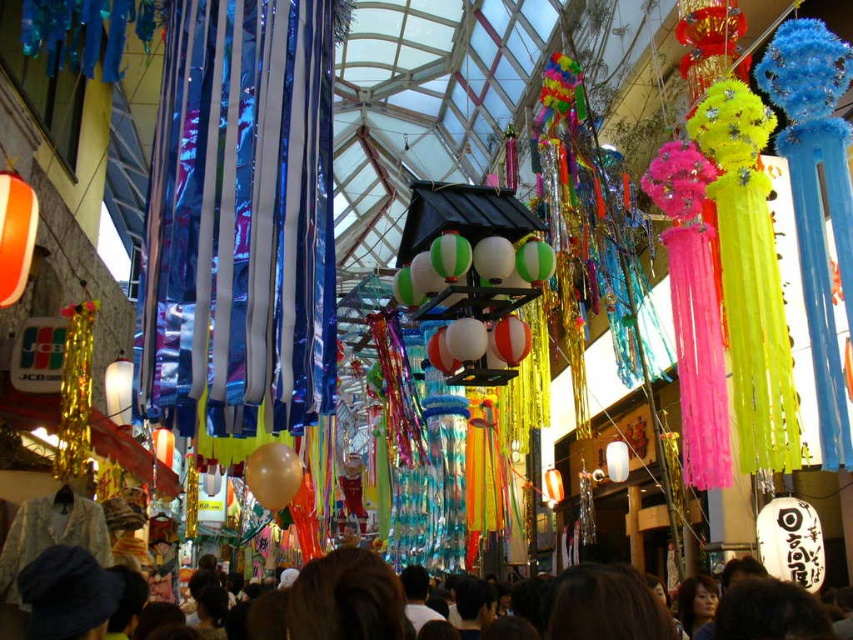
Question: Can you confirm if brown hair at center is positioned to the left of green and white striped balloons at center?

Choices:
 (A) no
 (B) yes

Answer: (B)

Question: Does green and white striped balloons at center appear on the right side of translucent gold balloon at center?

Choices:
 (A) no
 (B) yes

Answer: (B)

Question: Estimate the real-world distances between objects in this image. Which object is closer to the green and white striped balloons at center?

Choices:
 (A) brown hair at center
 (B) translucent gold balloon at center

Answer: (B)

Question: Which point appears farthest from the camera in this image?

Choices:
 (A) (560, 625)
 (B) (480, 371)

Answer: (B)

Question: Where is brown hair at center located in relation to green and white striped balloons at center in the image?

Choices:
 (A) right
 (B) left

Answer: (B)

Question: Considering the real-world distances, which object is closest to the brown hair at center?

Choices:
 (A) translucent gold balloon at center
 (B) green and white striped balloons at center

Answer: (A)